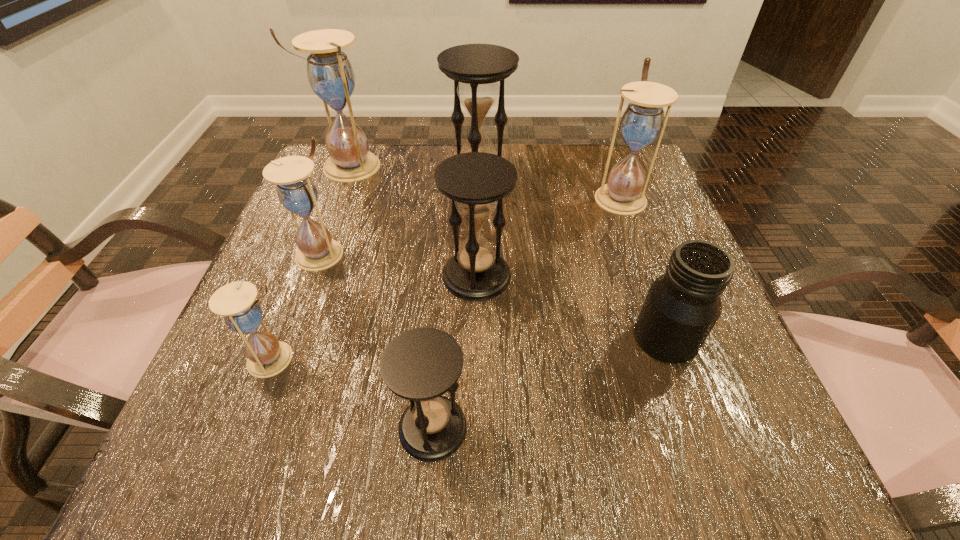
Where is `vacant space in between the second smallest white hourglass and the biggest white hourglass`? The image size is (960, 540). vacant space in between the second smallest white hourglass and the biggest white hourglass is located at coordinates (335, 210).

The width and height of the screenshot is (960, 540). Find the location of `free space that is in between the nearest white hourglass and the second smallest black hourglass`. free space that is in between the nearest white hourglass and the second smallest black hourglass is located at coordinates (375, 318).

Image resolution: width=960 pixels, height=540 pixels. Identify the location of free spot between the biggest black hourglass and the tallest hourglass. (415, 173).

I want to click on free space between the nearest black hourglass and the farthest black hourglass, so click(x=456, y=304).

What are the coordinates of `free point between the second smallest white hourglass and the tallest hourglass` in the screenshot? It's located at (335, 210).

You are a GUI agent. You are given a task and a screenshot of the screen. Output one action in this format:
    pyautogui.click(x=<x>, y=<y>)
    Task: Click on the object that stands as the third closest to the jar
    The height and width of the screenshot is (540, 960).
    Given the screenshot: What is the action you would take?
    pyautogui.click(x=421, y=364)

Locate which object is the second closest to the jar. Please provide its 2D coordinates. Your answer should be formatted as a tuple, i.e. [(x, y)], where the tuple contains the x and y coordinates of a point satisfying the conditions above.

[(643, 120)]

Locate an element on the screen. This screenshot has width=960, height=540. hourglass that is the fifth closest one to the third farthest white hourglass is located at coordinates (421, 364).

Identify which hourglass is located as the second nearest to the second nearest black hourglass. Please provide its 2D coordinates. Your answer should be formatted as a tuple, i.e. [(x, y)], where the tuple contains the x and y coordinates of a point satisfying the conditions above.

[(421, 364)]

Select which white hourglass appears as the closest to the sixth farthest hourglass. Please provide its 2D coordinates. Your answer should be formatted as a tuple, i.e. [(x, y)], where the tuple contains the x and y coordinates of a point satisfying the conditions above.

[(296, 191)]